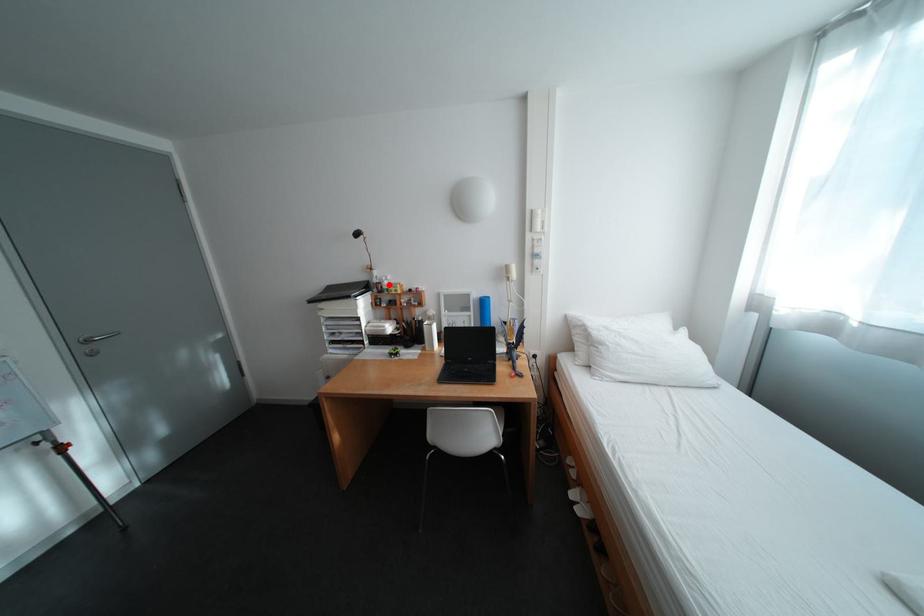
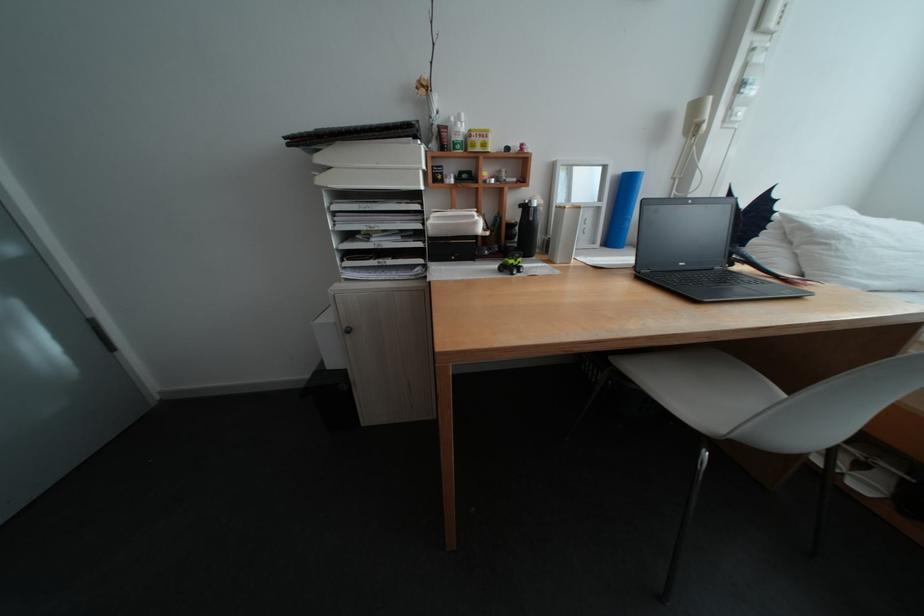
The point at the highlighted location is marked in the first image. Where is the corresponding point in the second image?

(453, 128)